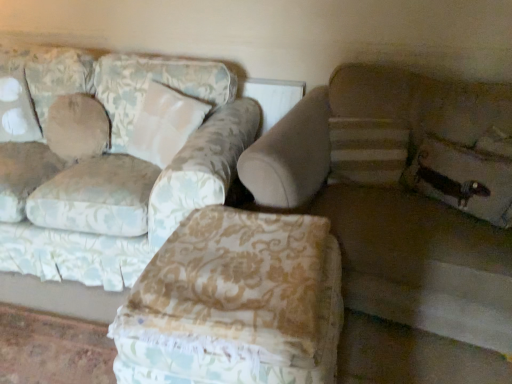
Question: Does beige fabric pillow at upper left, placed as the 2th pillow when sorted from front to back, have a greater width compared to floral fabric ottoman at center?

Choices:
 (A) no
 (B) yes

Answer: (A)

Question: Can you confirm if beige fabric pillow at upper left, the first pillow positioned from the back, is bigger than floral fabric ottoman at center?

Choices:
 (A) no
 (B) yes

Answer: (A)

Question: From the image's perspective, does beige fabric pillow at upper left, arranged as the 2th pillow when viewed from the right, appear higher than floral fabric ottoman at center?

Choices:
 (A) no
 (B) yes

Answer: (B)

Question: From a real-world perspective, is beige fabric pillow at upper left, the 1th pillow in the left-to-right sequence, physically above floral fabric ottoman at center?

Choices:
 (A) yes
 (B) no

Answer: (A)

Question: Is beige fabric pillow at upper left, the 1th pillow in the left-to-right sequence, not near floral fabric ottoman at center?

Choices:
 (A) no
 (B) yes

Answer: (B)

Question: Would you say floral fabric couch at left, which appears as the 1th studio couch when viewed from the left, is to the left or to the right of floral fabric ottoman at center in the picture?

Choices:
 (A) right
 (B) left

Answer: (B)

Question: From a real-world perspective, is floral fabric couch at left, the 2th studio couch in the right-to-left sequence, above or below floral fabric ottoman at center?

Choices:
 (A) below
 (B) above

Answer: (B)

Question: Is floral fabric couch at left, which appears as the 1th studio couch when viewed from the left, taller or shorter than floral fabric ottoman at center?

Choices:
 (A) tall
 (B) short

Answer: (A)

Question: From the image's perspective, is floral fabric couch at left, the 2th studio couch in the right-to-left sequence, positioned above or below floral fabric ottoman at center?

Choices:
 (A) above
 (B) below

Answer: (A)

Question: Based on their sizes in the image, would you say beige fabric couch at right, the second studio couch from the left, is bigger or smaller than floral fabric couch at left, which appears as the 1th studio couch when viewed from the left?

Choices:
 (A) small
 (B) big

Answer: (A)

Question: Would you say beige fabric couch at right, the second studio couch from the left, is inside or outside floral fabric couch at left, which appears as the 1th studio couch when viewed from the left?

Choices:
 (A) inside
 (B) outside

Answer: (B)

Question: Does point (389, 147) appear closer or farther from the camera than point (160, 104)?

Choices:
 (A) farther
 (B) closer

Answer: (B)

Question: From the image's perspective, is beige fabric couch at right, the first studio couch when ordered from right to left, positioned above or below floral fabric couch at left, which appears as the 1th studio couch when viewed from the left?

Choices:
 (A) above
 (B) below

Answer: (B)

Question: Considering their positions, is floral fabric ottoman at center located in front of or behind beige fabric pillow at upper left, the first pillow positioned from the back?

Choices:
 (A) behind
 (B) front

Answer: (B)

Question: Is point (337, 294) closer or farther from the camera than point (96, 147)?

Choices:
 (A) closer
 (B) farther

Answer: (A)